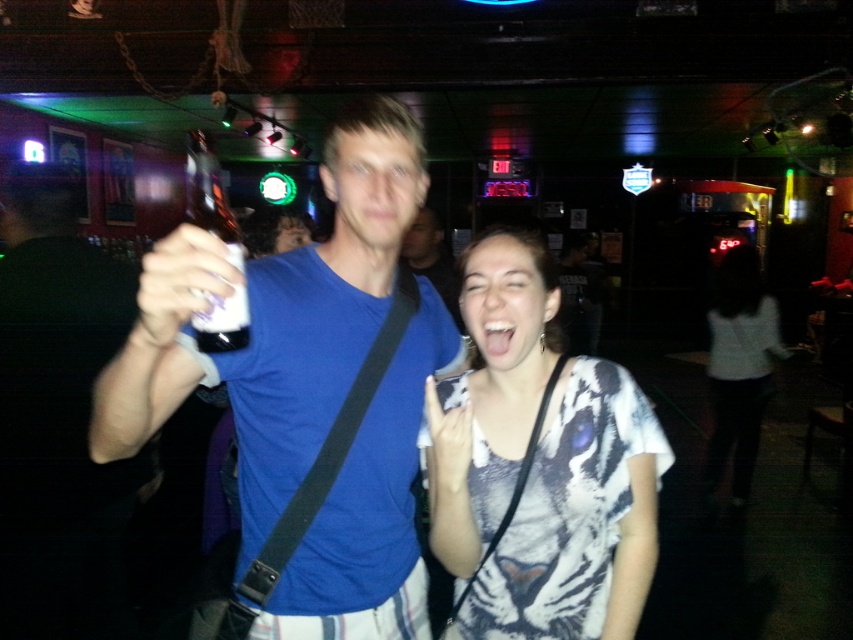
You are a photographer at the event and need to capture both the blue matte shirt at center and the white tiger print shirt at center in a single frame. Based on their positions, which one should you focus on first to ensure both are in the shot?

The blue matte shirt at center is to the left of the white tiger print shirt at center, so focusing on the white tiger print shirt at center first would allow you to frame both subjects since the blue matte shirt at center is positioned to its left.

You are a photographer at the event and need to capture both the white tiger print shirt at center and the clear plastic bottle at upper left in a single shot. Which object should you focus on first to ensure both are in focus?

You should focus on the white tiger print shirt at center first because it is closer to you than the clear plastic bottle at upper left, so focusing on the closer object will help both be in focus.